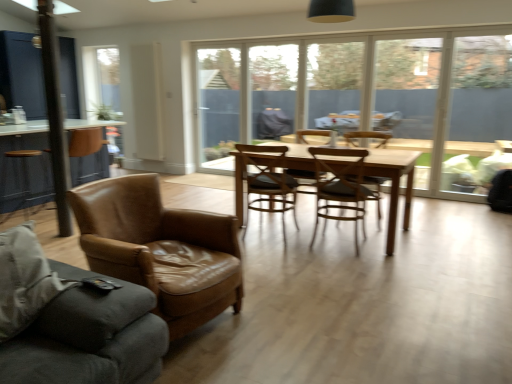
Question: Does brown leather table at left have a smaller size compared to transparent glass door at center?

Choices:
 (A) yes
 (B) no

Answer: (B)

Question: Is brown leather table at left positioned in front of transparent glass door at center?

Choices:
 (A) no
 (B) yes

Answer: (B)

Question: From the image's perspective, is brown leather table at left beneath transparent glass door at center?

Choices:
 (A) no
 (B) yes

Answer: (B)

Question: Is brown leather table at left positioned behind transparent glass door at center?

Choices:
 (A) yes
 (B) no

Answer: (B)

Question: Is transparent glass door at center located within brown leather table at left?

Choices:
 (A) yes
 (B) no

Answer: (B)

Question: Does brown leather table at left have a greater height compared to transparent glass door at center?

Choices:
 (A) no
 (B) yes

Answer: (A)

Question: From the image's perspective, is leather couch at left beneath wooden chair at center, which ranks as the 4th chair in front-to-back order?

Choices:
 (A) no
 (B) yes

Answer: (B)

Question: Are leather couch at left and wooden chair at center, the 2th chair from the back, located far from each other?

Choices:
 (A) no
 (B) yes

Answer: (B)

Question: Can you confirm if leather couch at left is wider than wooden chair at center, the 2th chair from the back?

Choices:
 (A) no
 (B) yes

Answer: (B)

Question: Is wooden chair at center, the 2th chair from the back, at the back of leather couch at left?

Choices:
 (A) yes
 (B) no

Answer: (B)

Question: Is the surface of leather couch at left in direct contact with wooden chair at center, the 2th chair from the back?

Choices:
 (A) yes
 (B) no

Answer: (B)

Question: From the image's perspective, is leather couch at left on top of wooden chair at center, the 2th chair from the back?

Choices:
 (A) yes
 (B) no

Answer: (B)

Question: Is brown leather armchair at left, the 1th chair in the front-to-back sequence, surrounded by leather couch at left?

Choices:
 (A) no
 (B) yes

Answer: (A)